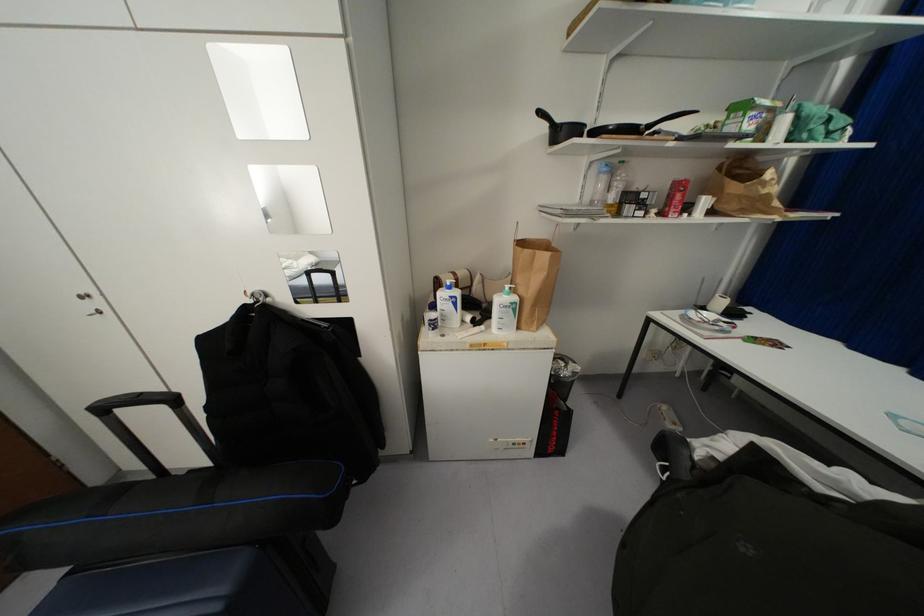
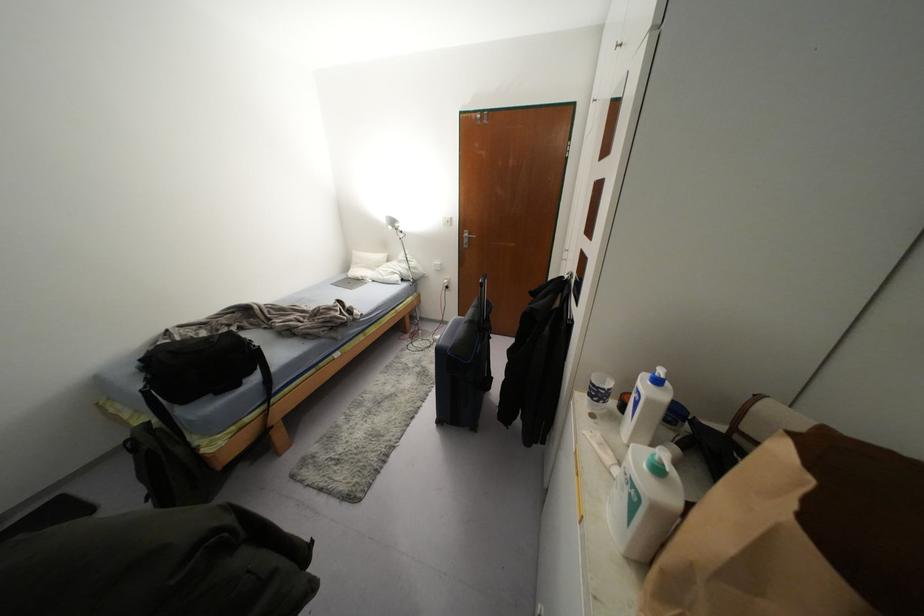
In the second image, find the point that corresponds to [432,329] in the first image.

(590, 395)